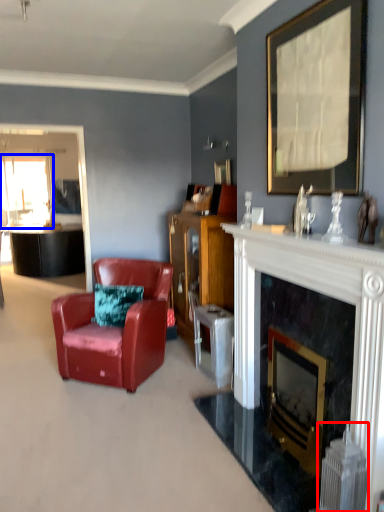
Question: Which object is closer to the camera taking this photo, radiator (highlighted by a red box) or window screen (highlighted by a blue box)?

Choices:
 (A) radiator
 (B) window screen

Answer: (A)